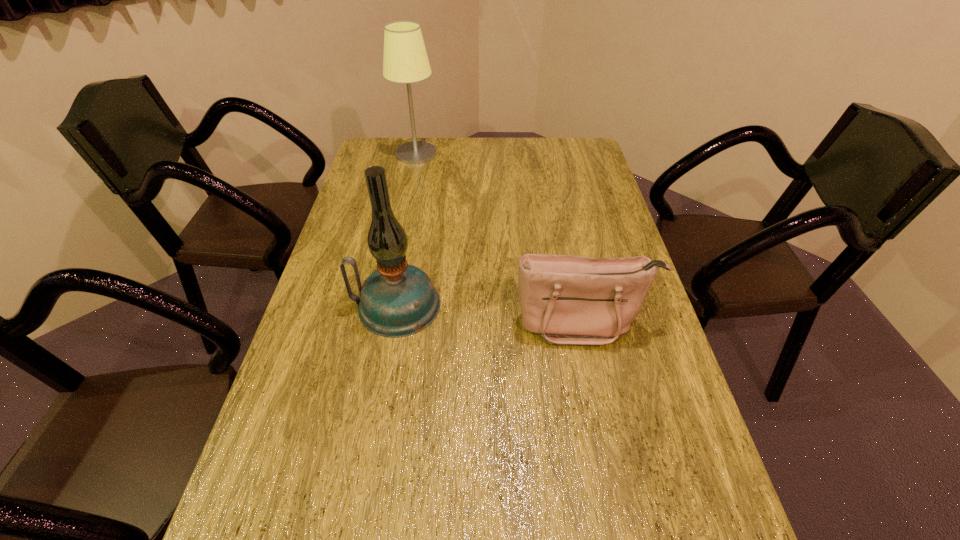
Find the location of `object present at the right edge`. object present at the right edge is located at coordinates (568, 300).

Image resolution: width=960 pixels, height=540 pixels. I want to click on object that is positioned at the far left corner, so click(405, 61).

You are a GUI agent. You are given a task and a screenshot of the screen. Output one action in this format:
    pyautogui.click(x=<x>, y=<y>)
    Task: Click on the vacant space at the far edge of the desktop
    The height and width of the screenshot is (540, 960).
    Given the screenshot: What is the action you would take?
    pyautogui.click(x=478, y=140)

The height and width of the screenshot is (540, 960). Find the location of `free location at the right edge`. free location at the right edge is located at coordinates (612, 398).

Locate an element on the screen. Image resolution: width=960 pixels, height=540 pixels. vacant space at the far left corner is located at coordinates (399, 168).

You are a GUI agent. You are given a task and a screenshot of the screen. Output one action in this format:
    pyautogui.click(x=<x>, y=<y>)
    Task: Click on the vacant area at the far right corner of the desktop
    
    Given the screenshot: What is the action you would take?
    pyautogui.click(x=595, y=159)

Where is `free space that is in between the rightmost object and the oil lamp`? The image size is (960, 540). free space that is in between the rightmost object and the oil lamp is located at coordinates (490, 314).

This screenshot has height=540, width=960. Find the location of `vacant area that lies between the shortest object and the farthest object`. vacant area that lies between the shortest object and the farthest object is located at coordinates (499, 238).

The height and width of the screenshot is (540, 960). I want to click on unoccupied area between the rightmost object and the oil lamp, so click(490, 314).

At what (x,y) coordinates should I click in order to perform the action: click on free space between the oil lamp and the rightmost object. Please return your answer as a coordinate pair (x, y). This screenshot has height=540, width=960. Looking at the image, I should click on (490, 314).